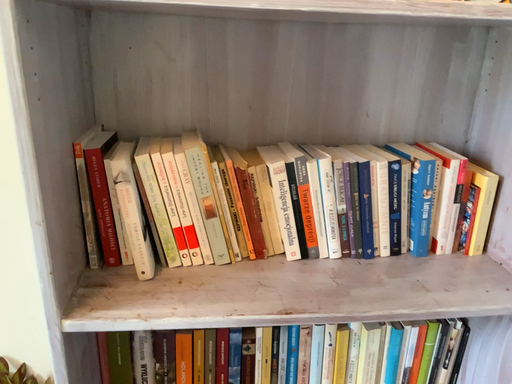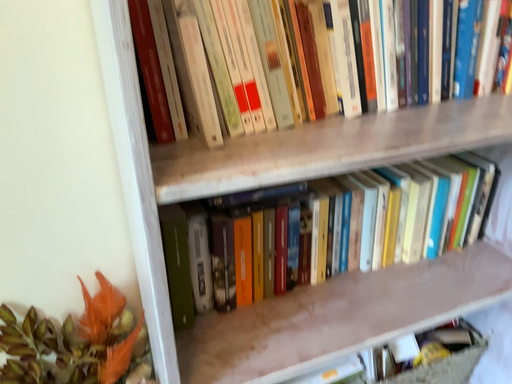
Question: Which way did the camera rotate in the video?

Choices:
 (A) rotated left
 (B) rotated right

Answer: (B)